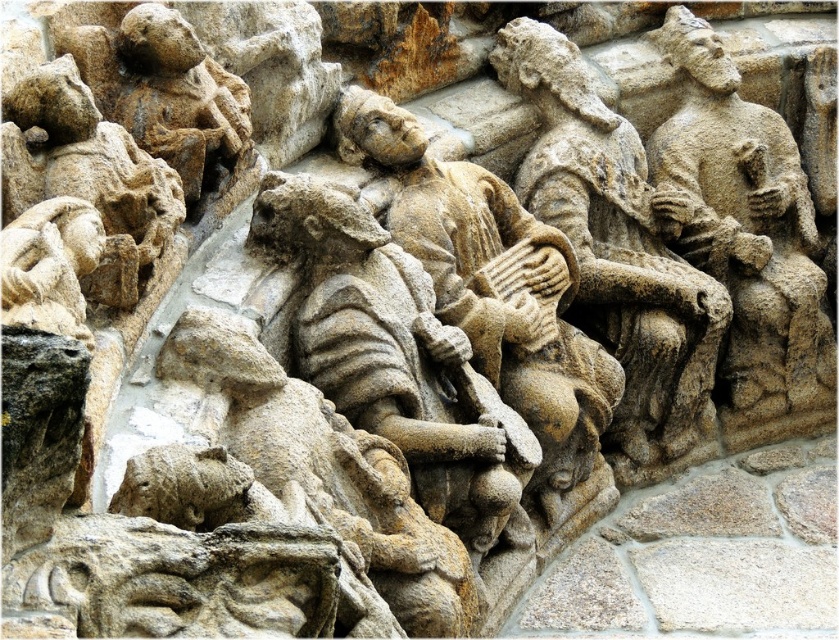
You are an art conservator examining the stone relief sculpture. You need to document the positions of the stone figure at center and the sandstone figure at right. Based on the scene, which figure is positioned to the left of the other?

The stone figure at center is to the left of the sandstone figure at right.

From the picture: You are an art conservator examining the stone relief sculpture. You notice the stone figure at center and the sandstone figure at right. Which figure might require more attention for its size relative to the other?

The stone figure at center is smaller than the sandstone figure at right, so it might require more attention due to its smaller size which could be more vulnerable to damage.

You are standing in front of a stone relief sculpture in a cathedral. You want to take a photo of the point at coordinates point (430, 490). If you are currently 163.50 feet away from this point, can you get a clear closeup shot without moving closer?

The point (430, 490) is 163.50 feet away from you. To capture a clear closeup shot, you would need to move closer as 163.50 feet is too far for a closeup without specialized equipment.